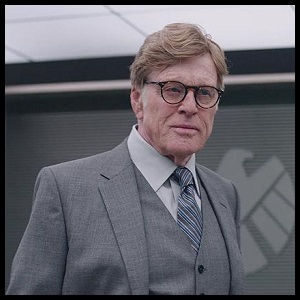
Image resolution: width=300 pixels, height=300 pixels. Identify the location of white tiled ceiling. (94, 35).